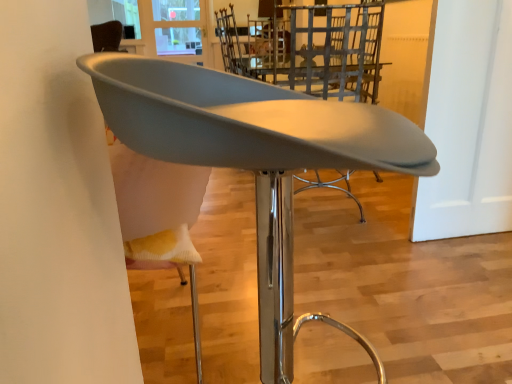
What do you see at coordinates (310, 48) in the screenshot? This screenshot has width=512, height=384. I see `metallic silver chair at center, which appears as the second chair when viewed from the front` at bounding box center [310, 48].

The image size is (512, 384). What do you see at coordinates (174, 29) in the screenshot?
I see `transparent glass window at upper center` at bounding box center [174, 29].

At what (x,y) coordinates should I click in order to perform the action: click on matte gray chair at center, the first chair from the front. Please return your answer as a coordinate pair (x, y). The height and width of the screenshot is (384, 512). Looking at the image, I should click on (255, 159).

Measure the distance between point (x=294, y=335) and camera.

Point (x=294, y=335) is 4.60 feet from camera.

In order to click on metallic silver chair at center, which appears as the second chair when viewed from the front in this screenshot , I will do `click(310, 48)`.

Could matte gray chair at center, the first chair from the front, be considered to be inside metallic silver chair at center, which appears as the second chair when viewed from the front?

No, matte gray chair at center, the first chair from the front, is located outside of metallic silver chair at center, which appears as the second chair when viewed from the front.

Is metallic silver chair at center, which ranks as the 1th chair in back-to-front order, thinner than matte gray chair at center, positioned as the second chair in back-to-front order?

No.

From the image's perspective, relative to matte gray chair at center, positioned as the second chair in back-to-front order, is metallic silver chair at center, which appears as the second chair when viewed from the front, above or below?

metallic silver chair at center, which appears as the second chair when viewed from the front, is situated higher than matte gray chair at center, positioned as the second chair in back-to-front order, in the image.

From a real-world perspective, is metallic silver chair at center, which ranks as the 1th chair in back-to-front order, positioned over matte gray chair at center, the first chair from the front, based on gravity?

Yes, from a real-world perspective, metallic silver chair at center, which ranks as the 1th chair in back-to-front order, is on top of matte gray chair at center, the first chair from the front.

From the picture: Are matte gray chair at center, positioned as the second chair in back-to-front order, and metallic silver chair at center, which ranks as the 1th chair in back-to-front order, located far from each other?

That's right, there is a large distance between matte gray chair at center, positioned as the second chair in back-to-front order, and metallic silver chair at center, which ranks as the 1th chair in back-to-front order.

Measure the distance from matte gray chair at center, the first chair from the front, to metallic silver chair at center, which ranks as the 1th chair in back-to-front order.

matte gray chair at center, the first chair from the front, is 1.25 meters away from metallic silver chair at center, which ranks as the 1th chair in back-to-front order.

Based on the photo, is matte gray chair at center, positioned as the second chair in back-to-front order, taller or shorter than metallic silver chair at center, which appears as the second chair when viewed from the front?

In the image, matte gray chair at center, positioned as the second chair in back-to-front order, appears to be shorter than metallic silver chair at center, which appears as the second chair when viewed from the front.

Who is smaller, matte gray chair at center, the first chair from the front, or metallic silver chair at center, which appears as the second chair when viewed from the front?

matte gray chair at center, the first chair from the front, is smaller.

Considering the relative positions of transparent glass window at upper center and matte gray chair at center, the first chair from the front, in the image provided, is transparent glass window at upper center behind matte gray chair at center, the first chair from the front,?

Yes, transparent glass window at upper center is further from the viewer.

Is transparent glass window at upper center with matte gray chair at center, the first chair from the front?

transparent glass window at upper center is not next to matte gray chair at center, the first chair from the front, and they're not touching.

Which object is thinner, transparent glass window at upper center or matte gray chair at center, positioned as the second chair in back-to-front order?

With smaller width is transparent glass window at upper center.

Is matte gray chair at center, positioned as the second chair in back-to-front order, at the back of transparent glass window at upper center?

That's not correct — transparent glass window at upper center is not looking away from matte gray chair at center, positioned as the second chair in back-to-front order.

Is metallic silver chair at center, which appears as the second chair when viewed from the front, positioned with its back to transparent glass window at upper center?

No, metallic silver chair at center, which appears as the second chair when viewed from the front, is not facing away from transparent glass window at upper center.

From the image's perspective, would you say metallic silver chair at center, which appears as the second chair when viewed from the front, is shown under transparent glass window at upper center?

Correct, metallic silver chair at center, which appears as the second chair when viewed from the front, appears lower than transparent glass window at upper center in the image.

Does metallic silver chair at center, which ranks as the 1th chair in back-to-front order, appear on the right side of transparent glass window at upper center?

Yes.

Are metallic silver chair at center, which appears as the second chair when viewed from the front, and transparent glass window at upper center far apart?

Yes, metallic silver chair at center, which appears as the second chair when viewed from the front, is far from transparent glass window at upper center.

What's the angular difference between matte gray chair at center, positioned as the second chair in back-to-front order, and transparent glass window at upper center's facing directions?

They differ by 75.5 degrees in their facing directions.

Is matte gray chair at center, positioned as the second chair in back-to-front order, smaller than transparent glass window at upper center?

No.

Looking at this image, is matte gray chair at center, positioned as the second chair in back-to-front order, completely or partially outside of transparent glass window at upper center?

That's correct, matte gray chair at center, positioned as the second chair in back-to-front order, is outside of transparent glass window at upper center.

Between matte gray chair at center, positioned as the second chair in back-to-front order, and transparent glass window at upper center, which one is positioned behind?

transparent glass window at upper center is behind.

Is transparent glass window at upper center oriented away from metallic silver chair at center, which ranks as the 1th chair in back-to-front order?

No, transparent glass window at upper center's orientation is not away from metallic silver chair at center, which ranks as the 1th chair in back-to-front order.

Consider the image. Between transparent glass window at upper center and metallic silver chair at center, which appears as the second chair when viewed from the front, which one is positioned behind?

transparent glass window at upper center.

Locate an element on the screen. Image resolution: width=512 pixels, height=384 pixels. chair below the metallic silver chair at center, which appears as the second chair when viewed from the front (from the image's perspective) is located at coordinates (255, 159).

Identify the location of chair on the left of metallic silver chair at center, which ranks as the 1th chair in back-to-front order. (255, 159).

From the picture: Based on their spatial positions, is metallic silver chair at center, which ranks as the 1th chair in back-to-front order, or matte gray chair at center, positioned as the second chair in back-to-front order, further from transparent glass window at upper center?

Based on the image, matte gray chair at center, positioned as the second chair in back-to-front order, appears to be further to transparent glass window at upper center.

Looking at the image, which one is located further to matte gray chair at center, the first chair from the front, metallic silver chair at center, which ranks as the 1th chair in back-to-front order, or transparent glass window at upper center?

transparent glass window at upper center is positioned further to the anchor matte gray chair at center, the first chair from the front.

Consider the image. When comparing their distances from metallic silver chair at center, which ranks as the 1th chair in back-to-front order, does matte gray chair at center, the first chair from the front, or transparent glass window at upper center seem closer?

The object closer to metallic silver chair at center, which ranks as the 1th chair in back-to-front order, is matte gray chair at center, the first chair from the front.

Which object lies further to the anchor point transparent glass window at upper center, matte gray chair at center, positioned as the second chair in back-to-front order, or metallic silver chair at center, which ranks as the 1th chair in back-to-front order?

Based on the image, matte gray chair at center, positioned as the second chair in back-to-front order, appears to be further to transparent glass window at upper center.

Which object lies nearer to the anchor point matte gray chair at center, the first chair from the front, transparent glass window at upper center or metallic silver chair at center, which ranks as the 1th chair in back-to-front order?

Based on the image, metallic silver chair at center, which ranks as the 1th chair in back-to-front order, appears to be nearer to matte gray chair at center, the first chair from the front.

When comparing their distances from metallic silver chair at center, which ranks as the 1th chair in back-to-front order, does transparent glass window at upper center or matte gray chair at center, the first chair from the front, seem further?

Among the two, transparent glass window at upper center is located further to metallic silver chair at center, which ranks as the 1th chair in back-to-front order.

This screenshot has width=512, height=384. What are the coordinates of `chair between matte gray chair at center, the first chair from the front, and transparent glass window at upper center, along the z-axis` in the screenshot? It's located at (310, 48).